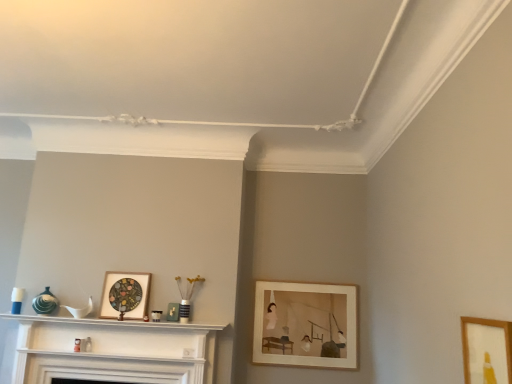
Locate an element on the screen. The image size is (512, 384). free spot above wooden picture frame at center-right, the 2th picture frame from the right (from a real-world perspective) is located at coordinates (298, 285).